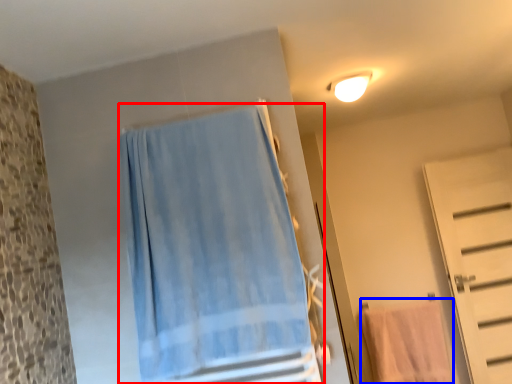
Question: Which object is further to the camera taking this photo, curtain (highlighted by a red box) or beach towel (highlighted by a blue box)?

Choices:
 (A) curtain
 (B) beach towel

Answer: (B)